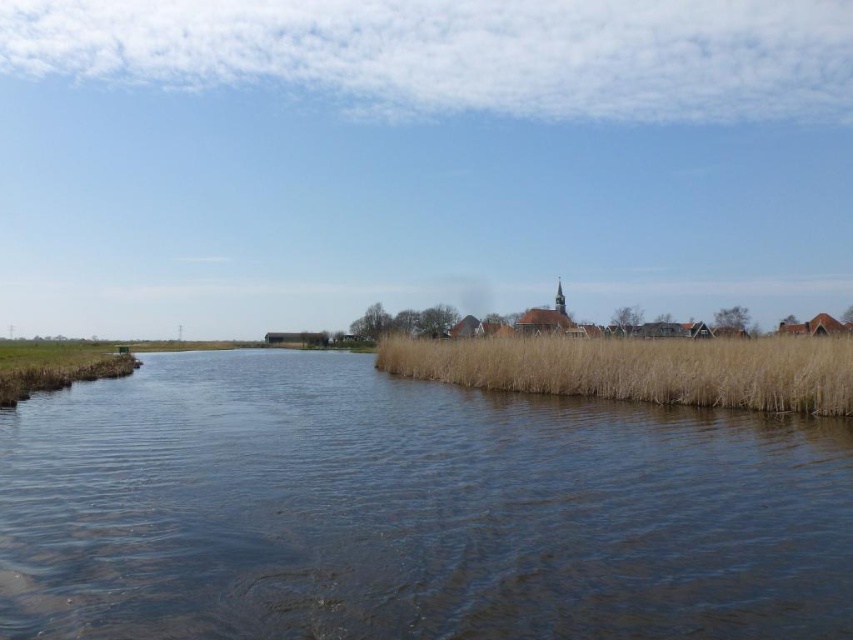
Question: Does brown grassy river at center have a lesser width compared to dry grass at center?

Choices:
 (A) yes
 (B) no

Answer: (B)

Question: Which of the following is the closest to the observer?

Choices:
 (A) dry grass at center
 (B) brown grassy river at center

Answer: (B)

Question: Which of these objects is positioned closest to the dry grass at center?

Choices:
 (A) brown grassy river at center
 (B) brown grassy reed at lower left

Answer: (A)

Question: Does brown grassy river at center appear over brown grassy reed at lower left?

Choices:
 (A) yes
 (B) no

Answer: (B)

Question: Which point is farther to the camera?

Choices:
 (A) (135, 426)
 (B) (608, 372)

Answer: (B)

Question: Observing the image, what is the correct spatial positioning of brown grassy river at center in reference to dry grass at center?

Choices:
 (A) left
 (B) right

Answer: (A)